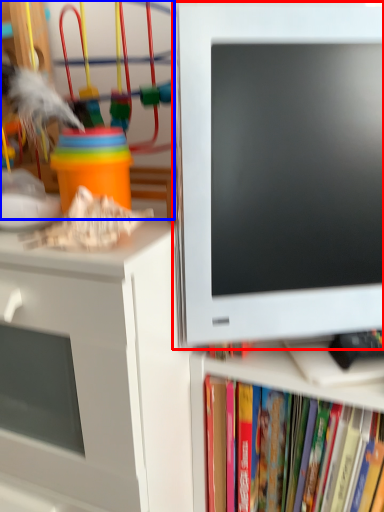
Question: Which object appears farthest to the camera in this image, computer monitor (highlighted by a red box) or toy (highlighted by a blue box)?

Choices:
 (A) computer monitor
 (B) toy

Answer: (B)